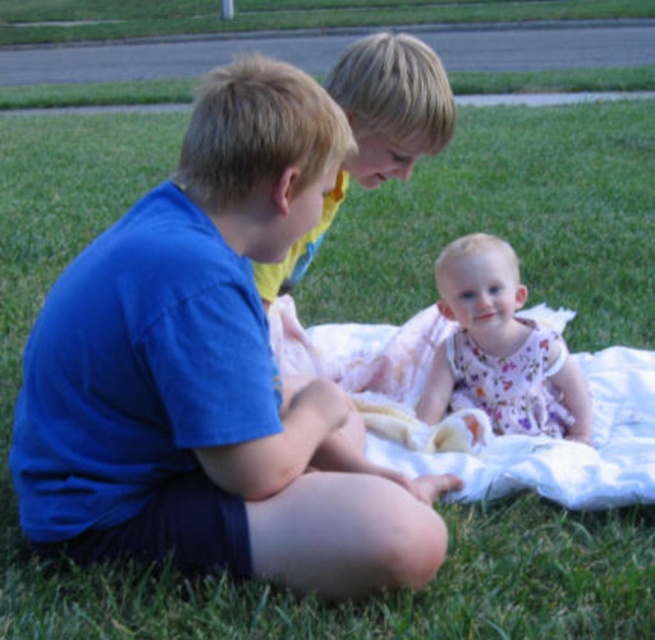
Question: Considering the real-world distances, which object is closest to the white cotton blanket at center?

Choices:
 (A) smooth blonde hair at center
 (B) floral dress at center

Answer: (B)

Question: Which is nearer to the white cotton blanket at center?

Choices:
 (A) floral dress at center
 (B) smooth blonde hair at center

Answer: (A)

Question: Can you confirm if floral dress at center is wider than smooth blonde hair at center?

Choices:
 (A) yes
 (B) no

Answer: (A)

Question: Which object is positioned farthest from the floral dress at center?

Choices:
 (A) white cotton blanket at center
 (B) smooth blonde hair at center

Answer: (B)

Question: Does white cotton blanket at center have a smaller size compared to floral dress at center?

Choices:
 (A) yes
 (B) no

Answer: (B)

Question: Is white cotton blanket at center above smooth blonde hair at center?

Choices:
 (A) no
 (B) yes

Answer: (A)